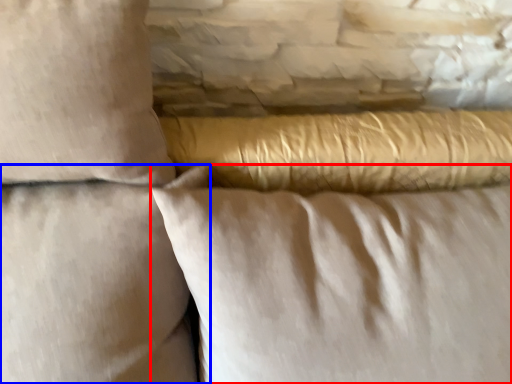
Question: Which of the following is the farthest to the observer, pillow (highlighted by a red box) or pillow (highlighted by a blue box)?

Choices:
 (A) pillow
 (B) pillow

Answer: (A)